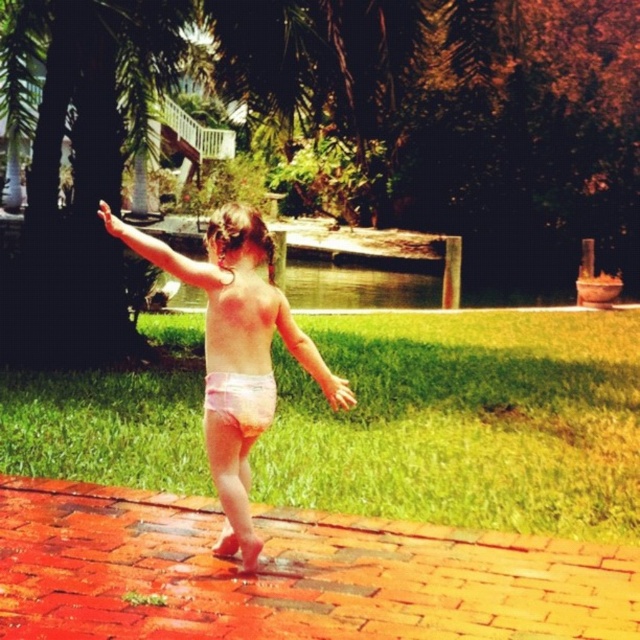
Question: Is pink cloth diaper at center to the right of pink fabric diaper at center from the viewer's perspective?

Choices:
 (A) no
 (B) yes

Answer: (A)

Question: Which of the following is the closest to the observer?

Choices:
 (A) pink cloth diaper at center
 (B) pink fabric diaper at center

Answer: (A)

Question: Which of the following is the closest to the observer?

Choices:
 (A) pink cloth diaper at center
 (B) pink fabric diaper at center

Answer: (A)

Question: Is pink cloth diaper at center to the right of pink fabric diaper at center from the viewer's perspective?

Choices:
 (A) yes
 (B) no

Answer: (B)

Question: In this image, where is pink cloth diaper at center located relative to pink fabric diaper at center?

Choices:
 (A) above
 (B) below

Answer: (A)